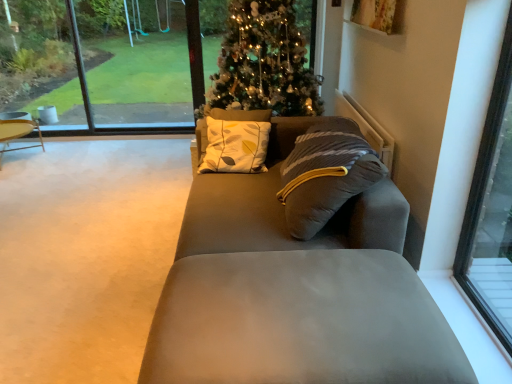
Locate an element on the screen. iridescent glass christmas tree at center is located at coordinates (263, 63).

I want to click on transparent glass window at right, the 2th window when ordered from top to bottom, so click(x=490, y=210).

The image size is (512, 384). Identify the location of suede gray couch at center. (295, 289).

This screenshot has width=512, height=384. Identify the location of transparent glass window at upper center, the 2th window in the right-to-left sequence. (109, 60).

This screenshot has height=384, width=512. In order to click on suede-like gray footrest at lower center in this screenshot , I will do `click(300, 321)`.

In the scene shown: In terms of height, does transparent glass window at upper center, which is the 1th window in back-to-front order, look taller or shorter compared to iridescent glass christmas tree at center?

transparent glass window at upper center, which is the 1th window in back-to-front order, is shorter than iridescent glass christmas tree at center.

Relative to iridescent glass christmas tree at center, is transparent glass window at upper center, acting as the second window starting from the bottom, in front or behind?

In the image, transparent glass window at upper center, acting as the second window starting from the bottom, appears behind iridescent glass christmas tree at center.

Is transparent glass window at upper center, positioned as the 2th window in front-to-back order, situated inside iridescent glass christmas tree at center or outside?

transparent glass window at upper center, positioned as the 2th window in front-to-back order, is spatially situated outside iridescent glass christmas tree at center.

In terms of size, does transparent glass window at upper center, the 2th window in the right-to-left sequence, appear bigger or smaller than iridescent glass christmas tree at center?

Considering their sizes, transparent glass window at upper center, the 2th window in the right-to-left sequence, takes up less space than iridescent glass christmas tree at center.

You are a GUI agent. You are given a task and a screenshot of the screen. Output one action in this format:
    pyautogui.click(x=<x>, y=<y>)
    Task: Click on the window on the left of the suede-like gray footrest at lower center
    
    Given the screenshot: What is the action you would take?
    pyautogui.click(x=109, y=60)

From a real-world perspective, is transparent glass window at upper center, positioned as the 2th window in front-to-back order, under suede-like gray footrest at lower center?

No.

Which is more to the right, transparent glass window at upper center, the 2th window in the right-to-left sequence, or suede-like gray footrest at lower center?

Positioned to the right is suede-like gray footrest at lower center.

Is point (156, 109) closer to viewer compared to point (191, 359)?

No.

Between wooden round table at left and transparent glass window at right, marked as the second window in a back-to-front arrangement, which one is positioned behind?

wooden round table at left is behind.

From a real-world perspective, between wooden round table at left and transparent glass window at right, positioned as the first window in bottom-to-top order, who is vertically higher?

transparent glass window at right, positioned as the first window in bottom-to-top order, from a real-world perspective.

Does wooden round table at left turn towards transparent glass window at right, the second window positioned from the left?

No, wooden round table at left is not oriented towards transparent glass window at right, the second window positioned from the left.

Considering the sizes of objects wooden round table at left and transparent glass window at right, marked as the second window in a back-to-front arrangement, in the image provided, who is taller, wooden round table at left or transparent glass window at right, marked as the second window in a back-to-front arrangement,?

With more height is transparent glass window at right, marked as the second window in a back-to-front arrangement.

Is wooden round table at left at the back of transparent glass window at upper left?

No, transparent glass window at upper left is not facing away from wooden round table at left.

Which of these two, transparent glass window at upper left or wooden round table at left, stands taller?

Standing taller between the two is transparent glass window at upper left.

Which is more to the right, transparent glass window at upper left or wooden round table at left?

transparent glass window at upper left is more to the right.

In terms of width, does transparent glass window at upper left look wider or thinner when compared to wooden round table at left?

In the image, transparent glass window at upper left appears to be more narrow than wooden round table at left.

From the picture: Between suede-like gray footrest at lower center and transparent glass window at right, the second window positioned from the left, which one has less height?

suede-like gray footrest at lower center.

How different are the orientations of suede-like gray footrest at lower center and transparent glass window at right, the second window positioned from the left, in degrees?

1.35 degrees separate the facing orientations of suede-like gray footrest at lower center and transparent glass window at right, the second window positioned from the left.

Which is correct: suede-like gray footrest at lower center is inside transparent glass window at right, the second window positioned from the left, or outside of it?

suede-like gray footrest at lower center is spatially situated outside transparent glass window at right, the second window positioned from the left.

Can you confirm if suede-like gray footrest at lower center is thinner than transparent glass window at right, the second window positioned from the left?

No, suede-like gray footrest at lower center is not thinner than transparent glass window at right, the second window positioned from the left.

Is transparent glass window at right, marked as the second window in a back-to-front arrangement, in contact with suede-like gray footrest at lower center?

They are not placed beside each other.

Is transparent glass window at right, marked as the second window in a back-to-front arrangement, wider than suede-like gray footrest at lower center?

No.

Would you say transparent glass window at right, positioned as the first window in bottom-to-top order, contains suede-like gray footrest at lower center?

That's incorrect, suede-like gray footrest at lower center is not inside transparent glass window at right, positioned as the first window in bottom-to-top order.

Where is `footrest below the transparent glass window at right, the 1th window when ordered from front to back (from a real-world perspective)`? The width and height of the screenshot is (512, 384). footrest below the transparent glass window at right, the 1th window when ordered from front to back (from a real-world perspective) is located at coordinates (300, 321).

Is point (215, 265) less distant than point (201, 113)?

Yes, point (215, 265) is closer to viewer.

Would you say suede gray couch at center contains iridescent glass christmas tree at center?

No, iridescent glass christmas tree at center is not surrounded by suede gray couch at center.

Find the location of a particular element. This screenshot has width=512, height=384. christmas tree on the left side of suede gray couch at center is located at coordinates coord(263,63).

You are a GUI agent. You are given a task and a screenshot of the screen. Output one action in this format:
    pyautogui.click(x=<x>, y=<y>)
    Task: Click on the window lying above the iridescent glass christmas tree at center (from the image's perspective)
    This screenshot has height=384, width=512.
    Given the screenshot: What is the action you would take?
    pyautogui.click(x=109, y=60)

From a real-world perspective, which window is the 2nd one above the suede-like gray footrest at lower center? Please provide its 2D coordinates.

[(109, 60)]

Considering their positions, is suede-like gray footrest at lower center positioned closer to transparent glass window at upper center, marked as the 1th window in a left-to-right arrangement, than wooden round table at left?

wooden round table at left is closer to transparent glass window at upper center, marked as the 1th window in a left-to-right arrangement.

From the image, which object appears to be farther from transparent glass window at right, the 1th window when ordered from front to back, suede-like gray footrest at lower center or wooden round table at left?

wooden round table at left is positioned further to the anchor transparent glass window at right, the 1th window when ordered from front to back.

Based on their spatial positions, is iridescent glass christmas tree at center or wooden round table at left closer to transparent glass window at right, marked as the second window in a back-to-front arrangement?

iridescent glass christmas tree at center.

Based on their spatial positions, is transparent glass window at right, the 1th window when ordered from front to back, or iridescent glass christmas tree at center further from transparent glass window at upper center, marked as the 1th window in a left-to-right arrangement?

transparent glass window at right, the 1th window when ordered from front to back, is further to transparent glass window at upper center, marked as the 1th window in a left-to-right arrangement.

When comparing their distances from suede gray couch at center, does transparent glass window at right, the 2th window when ordered from top to bottom, or transparent glass window at upper left seem closer?

transparent glass window at right, the 2th window when ordered from top to bottom, lies closer to suede gray couch at center than the other object.

From the image, which object appears to be nearer to transparent glass window at upper center, marked as the 1th window in a left-to-right arrangement, iridescent glass christmas tree at center or suede gray couch at center?

iridescent glass christmas tree at center.

Looking at the image, which one is located closer to suede-like gray footrest at lower center, transparent glass window at right, positioned as the first window in bottom-to-top order, or transparent glass window at upper center, acting as the second window starting from the bottom?

Among the two, transparent glass window at right, positioned as the first window in bottom-to-top order, is located nearer to suede-like gray footrest at lower center.

Based on their spatial positions, is transparent glass window at upper center, the 2th window in the right-to-left sequence, or iridescent glass christmas tree at center closer to suede gray couch at center?

Based on the image, iridescent glass christmas tree at center appears to be nearer to suede gray couch at center.

Find the location of a particular element. The width and height of the screenshot is (512, 384). christmas tree between transparent glass window at right, marked as the second window in a back-to-front arrangement, and transparent glass window at upper center, which is the 1th window in back-to-front order, in the front-back direction is located at coordinates (263, 63).

In order to click on christmas tree between suede gray couch at center and transparent glass window at upper left along the z-axis in this screenshot , I will do `click(263, 63)`.

At what (x,y) coordinates should I click in order to perform the action: click on window screen located between wooden round table at left and transparent glass window at upper center, which is the 1th window in top-to-bottom order, in the left-right direction. Please return your answer as a coordinate pair (x, y). The width and height of the screenshot is (512, 384). Looking at the image, I should click on (142, 61).

Image resolution: width=512 pixels, height=384 pixels. Identify the location of window located between transparent glass window at upper left and iridescent glass christmas tree at center in the left-right direction. (109, 60).